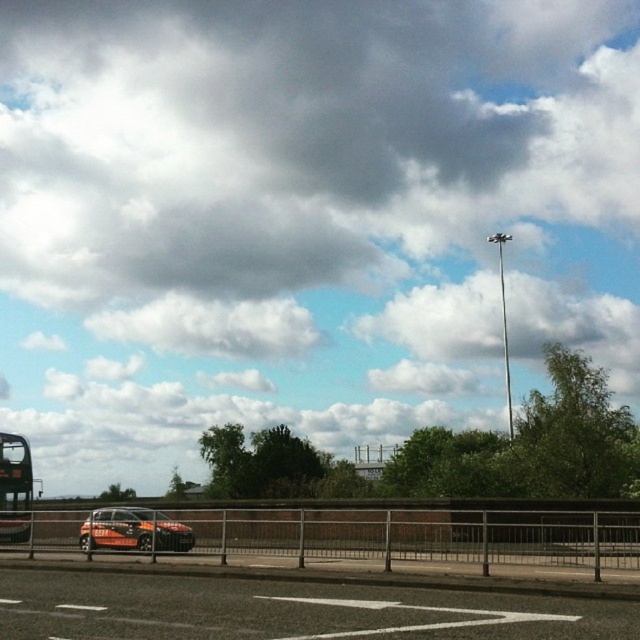
Is point (372, 589) farther from camera compared to point (180, 552)?

That is False.

Consider the image. Does smooth asphalt highway at center appear on the left side of orange matte car at lower left?

In fact, smooth asphalt highway at center is to the right of orange matte car at lower left.

Who is more distant from viewer, (198, 609) or (115, 508)?

Point (115, 508)

Where is `smooth asphalt highway at center`? smooth asphalt highway at center is located at coordinates point(296,605).

Which is below, orange matte car at lower left or black matte bus at left?

black matte bus at left

Based on the photo, can you confirm if orange matte car at lower left is positioned above black matte bus at left?

Indeed, orange matte car at lower left is positioned over black matte bus at left.

Does point (184, 531) come in front of point (22, 438)?

Yes.

Find the location of a particular element. This screenshot has width=640, height=640. orange matte car at lower left is located at coordinates (132, 531).

Can you confirm if smooth asphalt highway at center is positioned below black matte bus at left?

Actually, smooth asphalt highway at center is above black matte bus at left.

Which is in front, point (589, 605) or point (22, 497)?

Point (589, 605)

Which is behind, point (506, 612) or point (1, 531)?

The point (1, 531) is more distant.

The image size is (640, 640). Find the location of `smooth asphalt highway at center`. smooth asphalt highway at center is located at coordinates (296, 605).